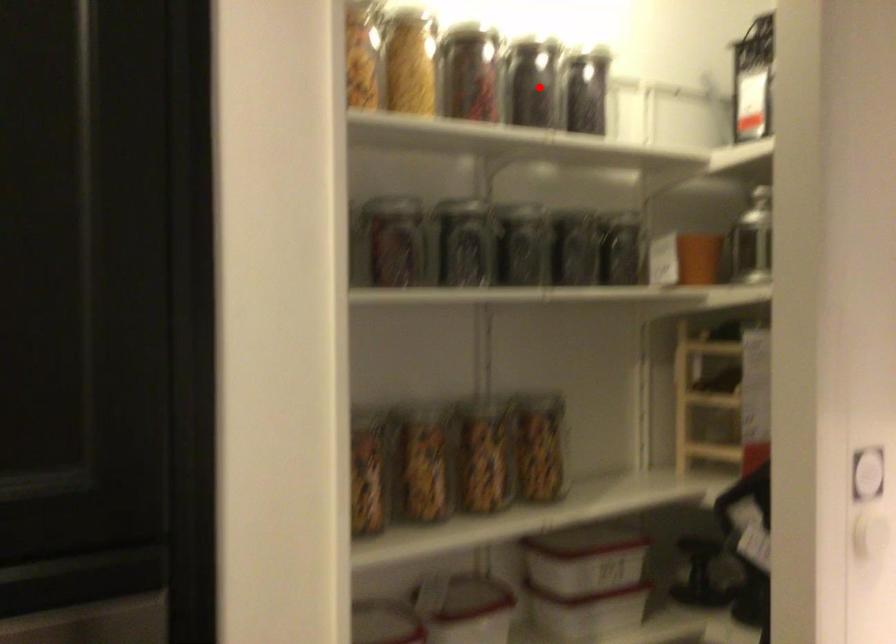
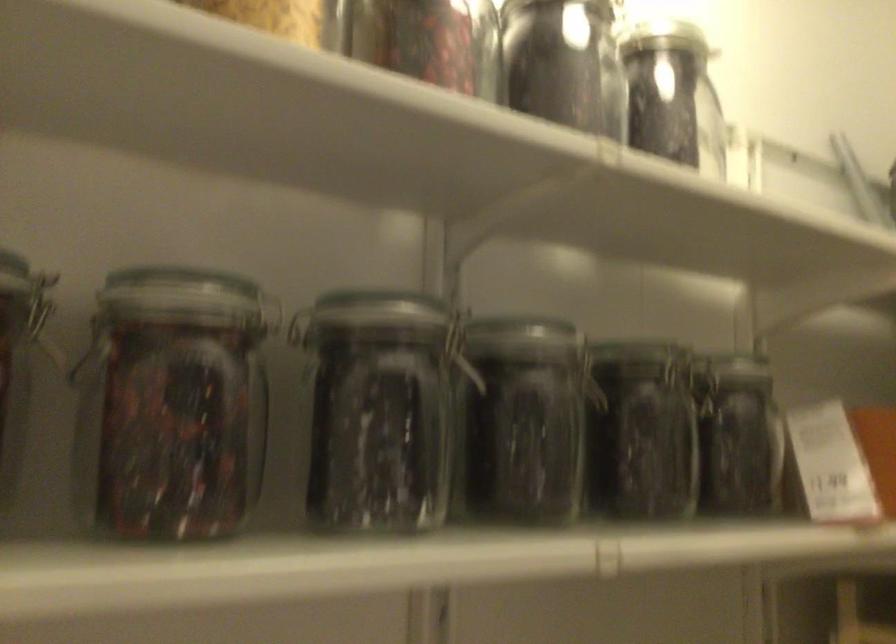
Question: A red point is marked in image1. In image2, is the corresponding 3D point closer to the camera or farther? Reply with the corresponding letter.

Choices:
 (A) The corresponding 3D point is closer.
 (B) The corresponding 3D point is farther.

Answer: (A)